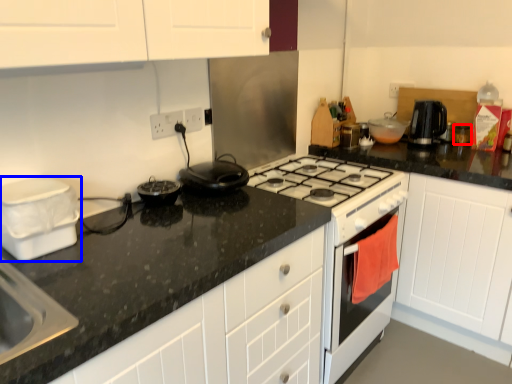
Question: Which object is closer to the camera taking this photo, kitchen appliance (highlighted by a red box) or kitchen appliance (highlighted by a blue box)?

Choices:
 (A) kitchen appliance
 (B) kitchen appliance

Answer: (B)